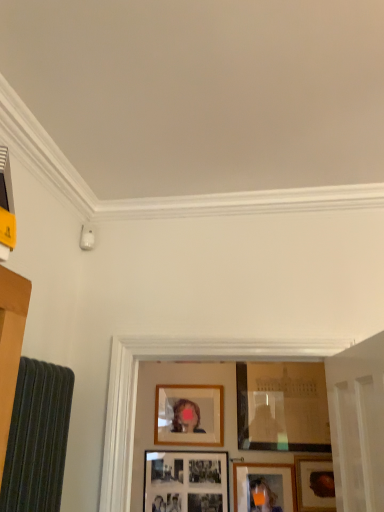
Question: From a real-world perspective, is matte wooden picture frame at lower center, which is the 3th picture frame in left-to-right order, positioned above or below wooden frame at lower right, which is the 5th picture frame in left-to-right order?

Choices:
 (A) above
 (B) below

Answer: (B)

Question: Considering the positions of matte wooden picture frame at lower center, which is the 3th picture frame in left-to-right order, and wooden frame at lower right, which is the 5th picture frame in left-to-right order, in the image, is matte wooden picture frame at lower center, which is the 3th picture frame in left-to-right order, wider or thinner than wooden frame at lower right, which is the 5th picture frame in left-to-right order,?

Choices:
 (A) wide
 (B) thin

Answer: (B)

Question: Which object is positioned farthest from the matte wooden picture frame at lower center, which is the 3th picture frame in left-to-right order?

Choices:
 (A) matte glass picture frame at center, the second picture frame viewed from the right
 (B) matte black picture frame at lower center, which is the 1th picture frame in left-to-right order
 (C) wooden picture frame at center, the fourth picture frame positioned from the right
 (D) wooden frame at lower right, acting as the first picture frame starting from the right

Answer: (C)

Question: Based on their relative distances, which object is nearer to the matte glass picture frame at center, acting as the 4th picture frame starting from the left?

Choices:
 (A) wooden picture frame at center, positioned as the second picture frame in left-to-right order
 (B) matte black picture frame at lower center, which is the 1th picture frame in left-to-right order
 (C) wooden frame at lower right, which is the 5th picture frame in left-to-right order
 (D) matte wooden picture frame at lower center, which is the 3th picture frame in left-to-right order

Answer: (C)